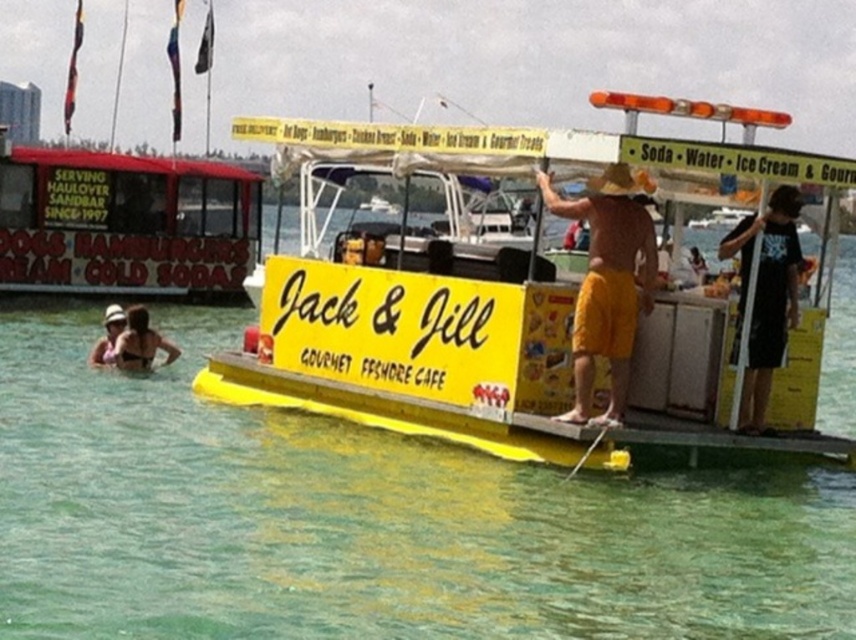
Question: Which object is the farthest from the black cotton shirt at right?

Choices:
 (A) red plastic food cart at left
 (B) clear water at center
 (C) matte black bikini at lower left
 (D) yellow plastic boat at center

Answer: (A)

Question: Which object is positioned closest to the black cotton shirt at right?

Choices:
 (A) matte white hat at upper left
 (B) clear water at center

Answer: (B)

Question: Is yellow plastic boat at center to the left of red plastic food cart at left from the viewer's perspective?

Choices:
 (A) yes
 (B) no

Answer: (B)

Question: Is yellow plastic boat at center to the right of red plastic food cart at left from the viewer's perspective?

Choices:
 (A) yes
 (B) no

Answer: (A)

Question: Can you confirm if yellow plastic boat at center is positioned above red plastic food cart at left?

Choices:
 (A) yes
 (B) no

Answer: (B)

Question: Based on their relative distances, which object is farther from the black cotton shirt at right?

Choices:
 (A) clear water at center
 (B) matte white hat at upper left

Answer: (B)